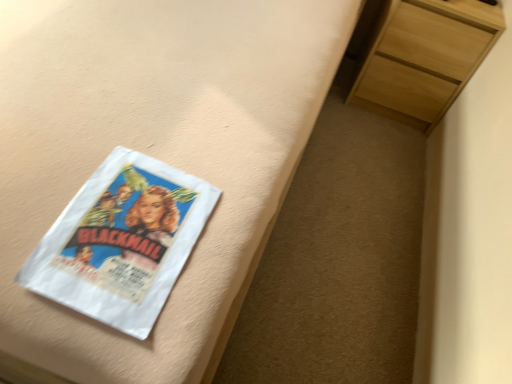
Locate an element on the screen. free space above white paper at left (from a real-world perspective) is located at coordinates (122, 207).